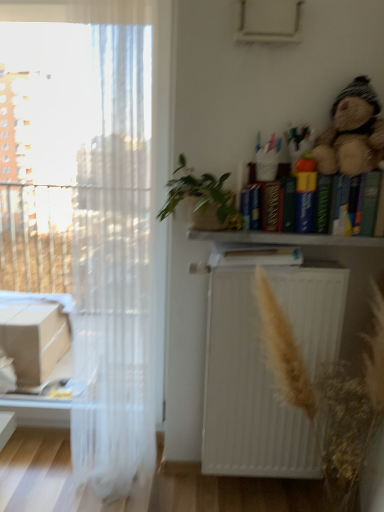
Question: Considering the relative sizes of wooden bookshelf at upper right and green woven basket at upper center in the image provided, is wooden bookshelf at upper right taller than green woven basket at upper center?

Choices:
 (A) no
 (B) yes

Answer: (A)

Question: Is wooden bookshelf at upper right positioned beyond the bounds of green woven basket at upper center?

Choices:
 (A) no
 (B) yes

Answer: (B)

Question: From the image's perspective, is wooden bookshelf at upper right under green woven basket at upper center?

Choices:
 (A) no
 (B) yes

Answer: (B)

Question: From the image's perspective, is wooden bookshelf at upper right on green woven basket at upper center?

Choices:
 (A) no
 (B) yes

Answer: (A)

Question: Does wooden bookshelf at upper right appear on the right side of green woven basket at upper center?

Choices:
 (A) no
 (B) yes

Answer: (B)

Question: From a real-world perspective, relative to green woven basket at upper center, is wooden bookshelf at upper right vertically above or below?

Choices:
 (A) below
 (B) above

Answer: (A)

Question: Would you say wooden bookshelf at upper right is to the left or to the right of green woven basket at upper center in the picture?

Choices:
 (A) left
 (B) right

Answer: (B)

Question: Is wooden bookshelf at upper right bigger or smaller than green woven basket at upper center?

Choices:
 (A) big
 (B) small

Answer: (B)

Question: Do you think wooden bookshelf at upper right is within green woven basket at upper center, or outside of it?

Choices:
 (A) outside
 (B) inside

Answer: (A)

Question: From the image's perspective, is hardcover book at center, the 1th book in the left-to-right sequence, above or below green woven basket at upper center?

Choices:
 (A) above
 (B) below

Answer: (B)

Question: Is hardcover book at center, the first book when ordered from bottom to top, situated inside green woven basket at upper center or outside?

Choices:
 (A) inside
 (B) outside

Answer: (B)

Question: In terms of height, does hardcover book at center, the 1th book in the left-to-right sequence, look taller or shorter compared to green woven basket at upper center?

Choices:
 (A) short
 (B) tall

Answer: (A)

Question: Based on their sizes in the image, would you say hardcover book at center, the 1th book in the left-to-right sequence, is bigger or smaller than green woven basket at upper center?

Choices:
 (A) big
 (B) small

Answer: (B)

Question: From their relative heights in the image, would you say fuzzy brown teddy bear at upper right is taller or shorter than green woven basket at upper center?

Choices:
 (A) short
 (B) tall

Answer: (B)

Question: From the image's perspective, is fuzzy brown teddy bear at upper right positioned above or below green woven basket at upper center?

Choices:
 (A) below
 (B) above

Answer: (B)